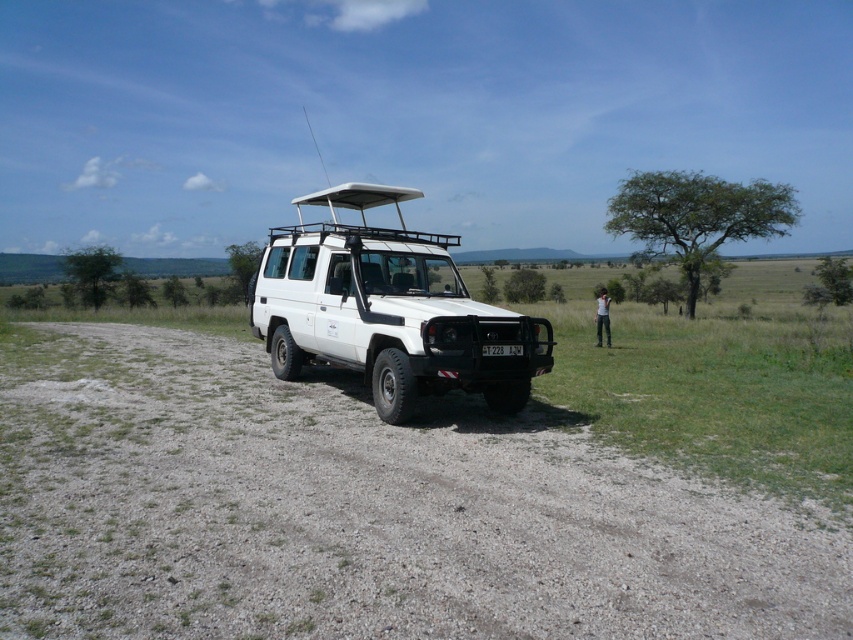
You are planning a photography session and need to position a tripod in the exact center of the image. The white matte jeep at center is currently occupying part of the center area. Can you confirm if the jeep is exactly at the center coordinates of the image?

The white matte jeep at center is located at point [386,308], which is very close to the center coordinates of the image but not exactly at the center. Therefore, the tripod would need to be placed slightly to the right and slightly below the current position of the jeep to reach the exact center.

You are a photographer standing at the edge of the savanna. You want to take a photo that includes both the white matte jeep at center and the black plastic license plate at center. Since you want the license plate to be clearly visible, will you need to adjust your camera angle upwards or downwards to focus on the license plate while keeping the jeep in the frame?

The white matte jeep at center is much taller than the black plastic license plate at center. To focus on the license plate while keeping the jeep in the frame, you would need to adjust your camera angle downwards because the license plate is lower than the jeep.